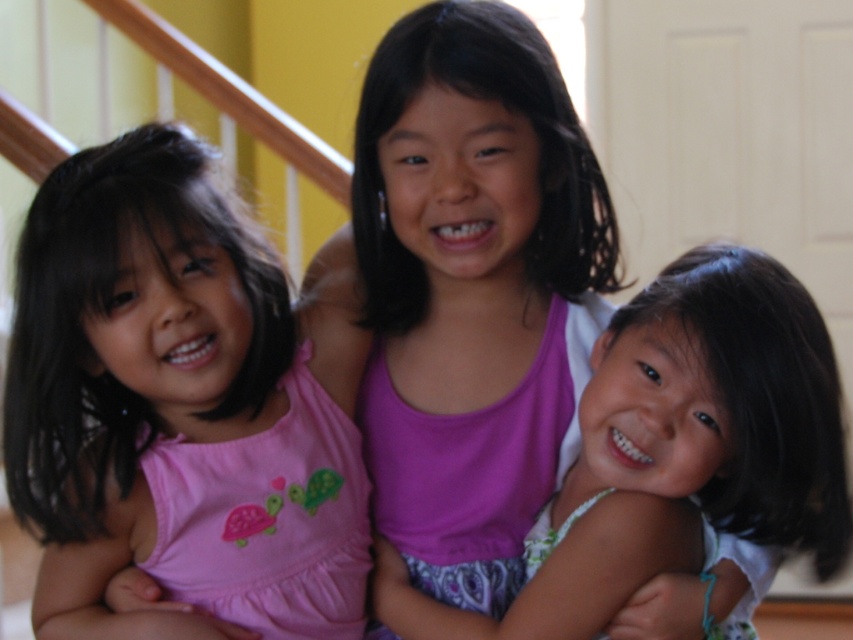
Does pink fabric dress at center have a larger size compared to matte pink dress at center?

Indeed, pink fabric dress at center has a larger size compared to matte pink dress at center.

Can you confirm if pink fabric dress at center is positioned to the right of matte pink dress at center?

Incorrect, pink fabric dress at center is not on the right side of matte pink dress at center.

Which is behind, point (91, 499) or point (639, 522)?

The point (91, 499) is behind.

Find the location of a particular element. pink fabric dress at center is located at coordinates (183, 404).